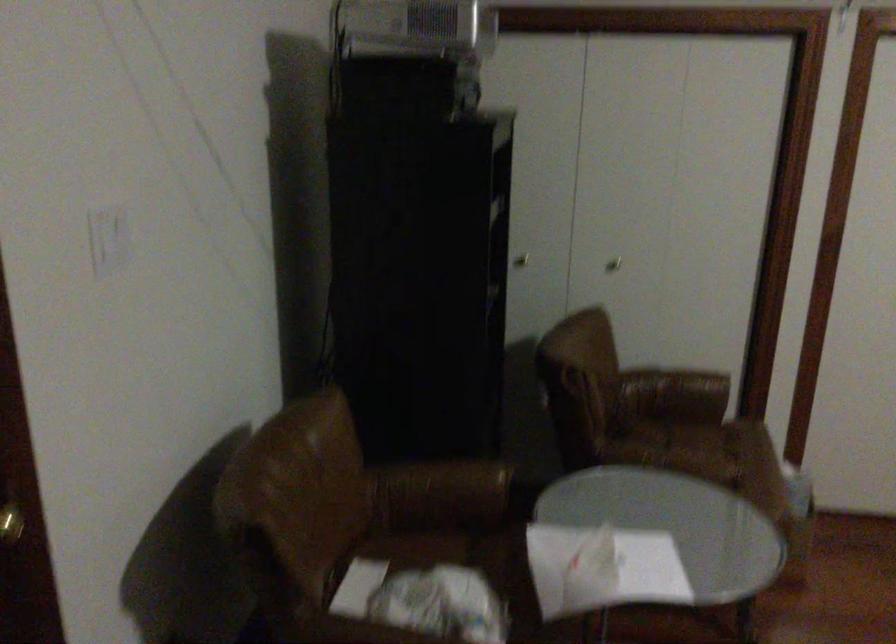
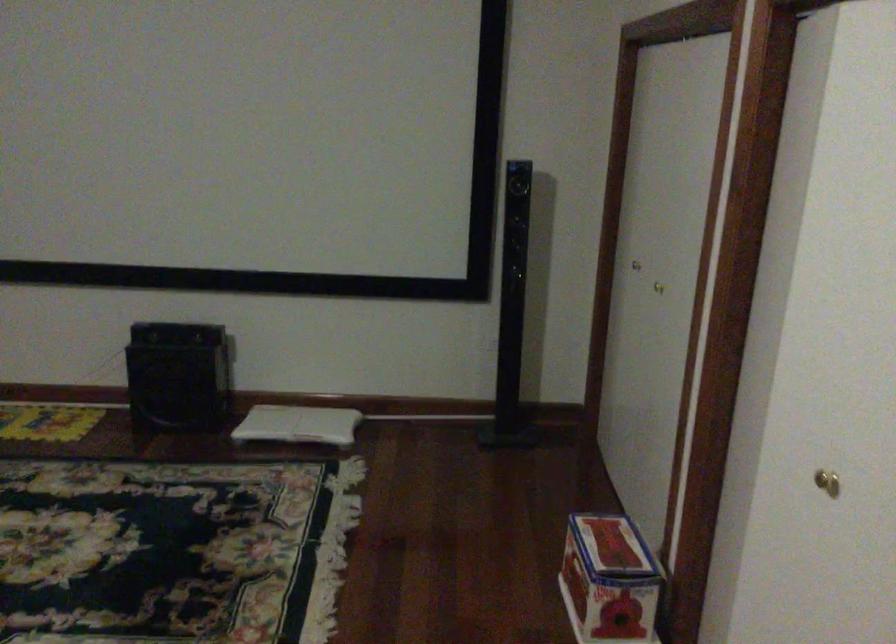
In the scene shown: How did the camera likely rotate?

The camera's rotation is toward right-down.